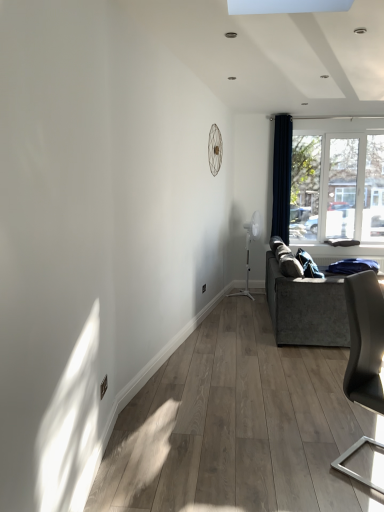
Locate an element on the screen. The image size is (384, 512). vacant space behind matte gray chair at right is located at coordinates (330, 422).